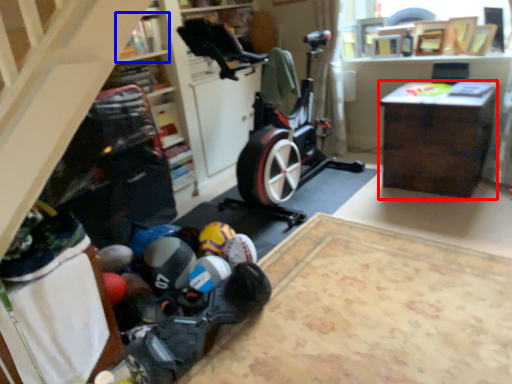
Question: Which point is further to the camera, desk (highlighted by a red box) or shelf (highlighted by a blue box)?

Choices:
 (A) desk
 (B) shelf

Answer: (A)